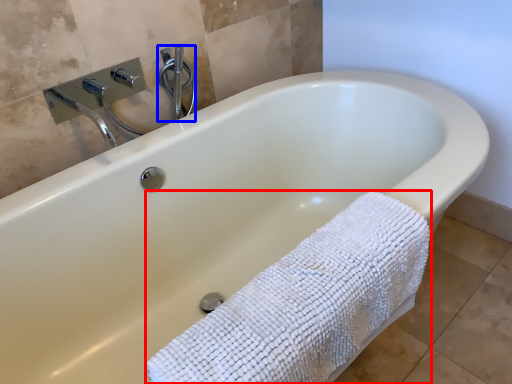
Question: Which point is closer to the camera, bath towel (highlighted by a red box) or shower (highlighted by a blue box)?

Choices:
 (A) bath towel
 (B) shower

Answer: (A)